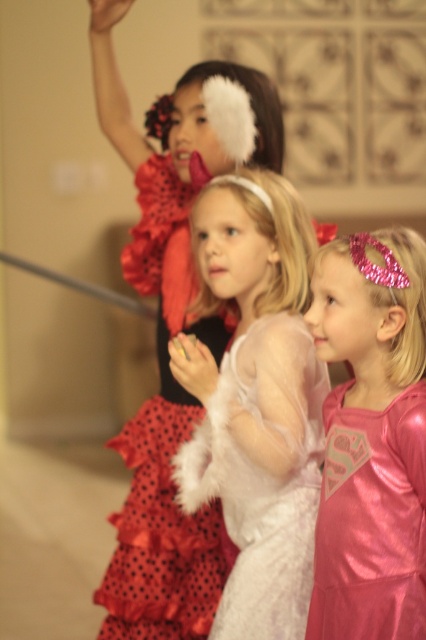
You are a photographer trying to capture a closeup of the child in the pink superhero dress. You are currently positioned at the point closest to the camera between the two points marked as point (172, 589) and point (167, 534). Which point should you stand at to get the closest shot?

You should stand at point (172, 589) because it is closer to the camera than point (167, 534), allowing for a closer shot.

You are a photographer at a childrens party. You need to arrange the white fluffy dress at center and the pink shiny dress at center so that both are visible in the photo. Which child should stand closer to the camera to avoid being blocked by the other?

The white fluffy dress at center is much taller than the pink shiny dress at center, so the shorter child in the pink shiny dress at center should stand closer to the camera to avoid being blocked by the taller child in the white fluffy dress at center.

You are standing at the center of the room and see the point at coordinates (166, 346). Which object is located at that point?

The point at coordinates (166, 346) corresponds to the matte black dress at upper left.